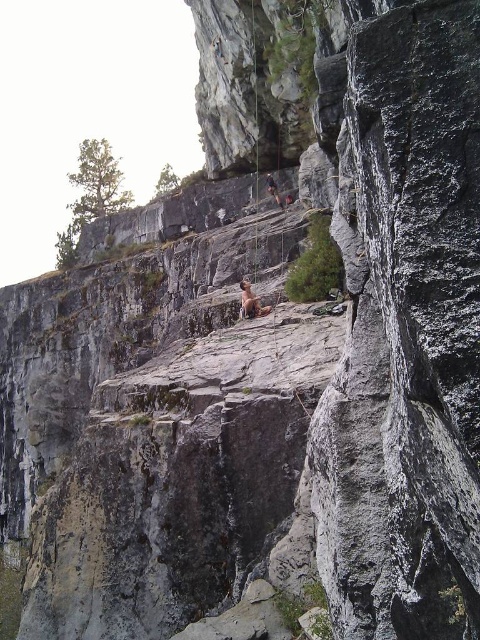
Who is positioned more to the right, smooth tan skin at center or matte gray rock climber at center?

Positioned to the right is matte gray rock climber at center.

From the picture: Is smooth tan skin at center bigger than matte gray rock climber at center?

Indeed, smooth tan skin at center has a larger size compared to matte gray rock climber at center.

This screenshot has width=480, height=640. I want to click on smooth tan skin at center, so click(251, 301).